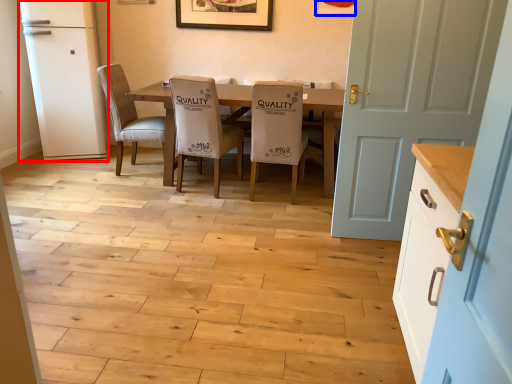
Question: Which object appears farthest to the camera in this image, fridge (highlighted by a red box) or picture frame (highlighted by a blue box)?

Choices:
 (A) fridge
 (B) picture frame

Answer: (B)